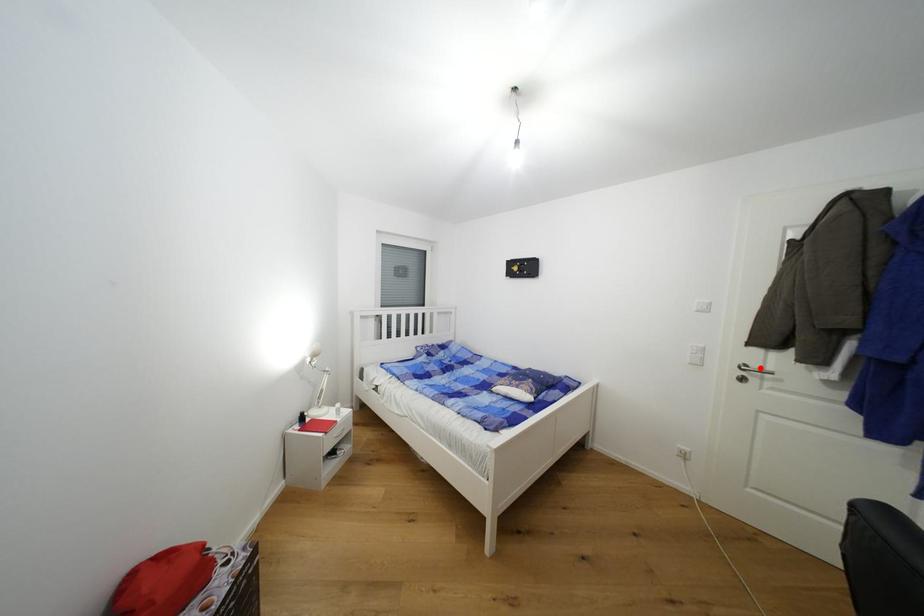
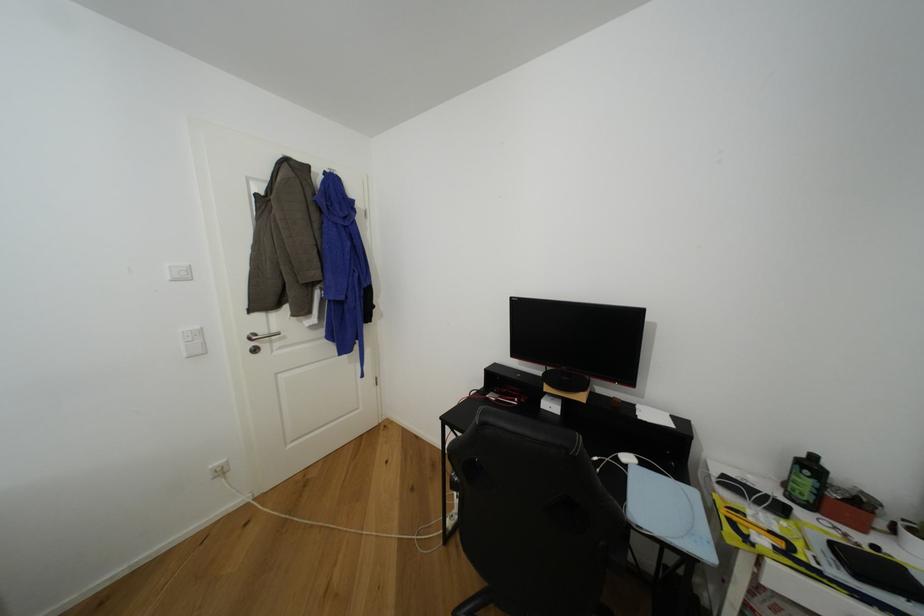
Where in the second image is the point corresponding to the highlighted location from the first image?

(268, 334)